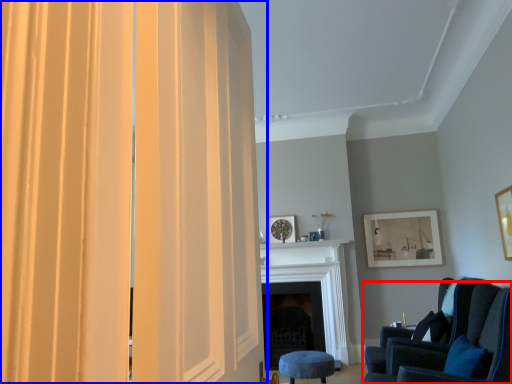
Question: Which of the following is the closest to the observer, chair (highlighted by a red box) or curtain (highlighted by a blue box)?

Choices:
 (A) chair
 (B) curtain

Answer: (B)